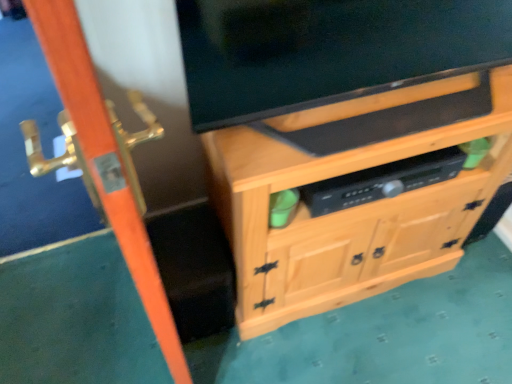
This screenshot has height=384, width=512. I want to click on natural wood cabinet at center, so click(347, 216).

Locate an element on the screen. Image resolution: width=512 pixels, height=384 pixels. matte black tv at upper center is located at coordinates (328, 51).

Identify the location of natural wood cabinet at center. Image resolution: width=512 pixels, height=384 pixels. (347, 216).

Which of these two, black plastic speaker at center or orange wood screen door at left, is bigger?

With larger size is orange wood screen door at left.

Is black plastic speaker at center situated inside orange wood screen door at left or outside?

black plastic speaker at center is located beyond the bounds of orange wood screen door at left.

From their relative heights in the image, would you say black plastic speaker at center is taller or shorter than orange wood screen door at left?

In the image, black plastic speaker at center appears to be shorter than orange wood screen door at left.

From the image's perspective, would you say black plastic speaker at center is shown under orange wood screen door at left?

No.

How different are the orientations of matte black tv at upper center and black plastic speaker at center in degrees?

The facing directions of matte black tv at upper center and black plastic speaker at center are 0.87 degrees apart.

Is matte black tv at upper center beside black plastic speaker at center?

No, matte black tv at upper center is not touching black plastic speaker at center.

Which object is closer to the camera, matte black tv at upper center or black plastic speaker at center?

matte black tv at upper center is closer to the camera.

Which is in front, point (345, 202) or point (412, 254)?

The point (345, 202) is closer to the camera.

Looking at this image, from the image's perspective, who appears lower, black plastic speaker at center or natural wood cabinet at center?

natural wood cabinet at center is shown below in the image.

Based on their sizes in the image, would you say black plastic speaker at center is bigger or smaller than natural wood cabinet at center?

Considering their sizes, black plastic speaker at center takes up less space than natural wood cabinet at center.

Which object is thinner, black plastic speaker at center or natural wood cabinet at center?

Thinner between the two is black plastic speaker at center.

From a real-world perspective, is natural wood cabinet at center above or below black plastic speaker at center?

From a real-world perspective, natural wood cabinet at center is physically below black plastic speaker at center.

The width and height of the screenshot is (512, 384). What are the coordinates of `appliance positioned vertically above the natural wood cabinet at center (from a real-world perspective)` in the screenshot? It's located at (382, 181).

In the scene shown: Does natural wood cabinet at center appear on the right side of black plastic speaker at center?

No.

Considering the relative sizes of natural wood cabinet at center and black plastic speaker at center in the image provided, is natural wood cabinet at center thinner than black plastic speaker at center?

No.

From a real-world perspective, which is physically below, orange wood screen door at left or black plastic speaker at center?

black plastic speaker at center is physically lower.

Considering the positions of objects orange wood screen door at left and black plastic speaker at center in the image provided, who is in front, orange wood screen door at left or black plastic speaker at center?

orange wood screen door at left is closer to the camera.

Considering the sizes of orange wood screen door at left and black plastic speaker at center in the image, is orange wood screen door at left taller or shorter than black plastic speaker at center?

Clearly, orange wood screen door at left is taller compared to black plastic speaker at center.

Which point is more distant from viewer, (80, 61) or (461, 159)?

Point (461, 159)

Where is `television located above the orange wood screen door at left (from a real-world perspective)`? The height and width of the screenshot is (384, 512). television located above the orange wood screen door at left (from a real-world perspective) is located at coordinates (328, 51).

From the image's perspective, which is below, orange wood screen door at left or matte black tv at upper center?

From the image's view, orange wood screen door at left is below.

Is orange wood screen door at left not inside matte black tv at upper center?

Yes.

Looking at this image, how different are the orientations of orange wood screen door at left and matte black tv at upper center in degrees?

The angle between the facing direction of orange wood screen door at left and the facing direction of matte black tv at upper center is 81.9 degrees.

From the image's perspective, is matte black tv at upper center located above or below orange wood screen door at left?

matte black tv at upper center is above orange wood screen door at left.

Considering the sizes of objects matte black tv at upper center and orange wood screen door at left in the image provided, who is wider, matte black tv at upper center or orange wood screen door at left?

matte black tv at upper center.

Can you confirm if matte black tv at upper center is taller than orange wood screen door at left?

No, matte black tv at upper center is not taller than orange wood screen door at left.

Is matte black tv at upper center oriented towards orange wood screen door at left?

No, matte black tv at upper center is not oriented towards orange wood screen door at left.

I want to click on appliance directly beneath the orange wood screen door at left (from a real-world perspective), so click(382, 181).

The width and height of the screenshot is (512, 384). In order to click on appliance below the matte black tv at upper center (from the image's perspective) in this screenshot , I will do `click(382, 181)`.

From the image, which object appears to be nearer to orange wood screen door at left, matte black tv at upper center or black plastic speaker at center?

matte black tv at upper center is positioned closer to the anchor orange wood screen door at left.

Considering their positions, is orange wood screen door at left positioned further to matte black tv at upper center than natural wood cabinet at center?

orange wood screen door at left.

When comparing their distances from black plastic speaker at center, does natural wood cabinet at center or orange wood screen door at left seem closer?

Among the two, natural wood cabinet at center is located nearer to black plastic speaker at center.

Estimate the real-world distances between objects in this image. Which object is closer to black plastic speaker at center, matte black tv at upper center or natural wood cabinet at center?

A: natural wood cabinet at center.

Considering their positions, is matte black tv at upper center positioned further to black plastic speaker at center than orange wood screen door at left?

orange wood screen door at left is positioned further to the anchor black plastic speaker at center.

Which object lies further to the anchor point natural wood cabinet at center, matte black tv at upper center or black plastic speaker at center?

The object further to natural wood cabinet at center is matte black tv at upper center.

Considering their positions, is matte black tv at upper center positioned closer to orange wood screen door at left than natural wood cabinet at center?

matte black tv at upper center is positioned closer to the anchor orange wood screen door at left.

When comparing their distances from natural wood cabinet at center, does black plastic speaker at center or matte black tv at upper center seem closer?

The object closer to natural wood cabinet at center is black plastic speaker at center.

Locate an element on the screen. cabinetry between orange wood screen door at left and black plastic speaker at center in the horizontal direction is located at coordinates (347, 216).

Locate an element on the screen. television situated between orange wood screen door at left and black plastic speaker at center from left to right is located at coordinates (328, 51).

In order to click on television between orange wood screen door at left and natural wood cabinet at center in this screenshot , I will do `click(328, 51)`.

Locate an element on the screen. Image resolution: width=512 pixels, height=384 pixels. cabinetry positioned between matte black tv at upper center and black plastic speaker at center from near to far is located at coordinates (347, 216).